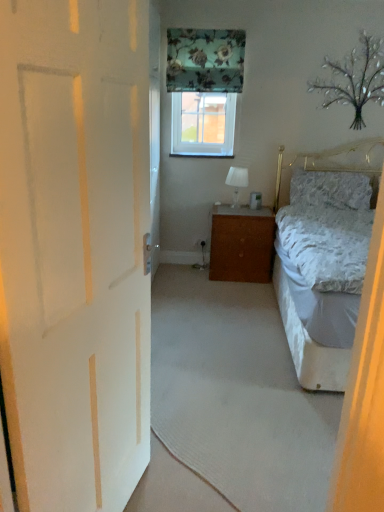
Where is `vacant area that is in front of brown wood cabinet at center`? vacant area that is in front of brown wood cabinet at center is located at coordinates (235, 290).